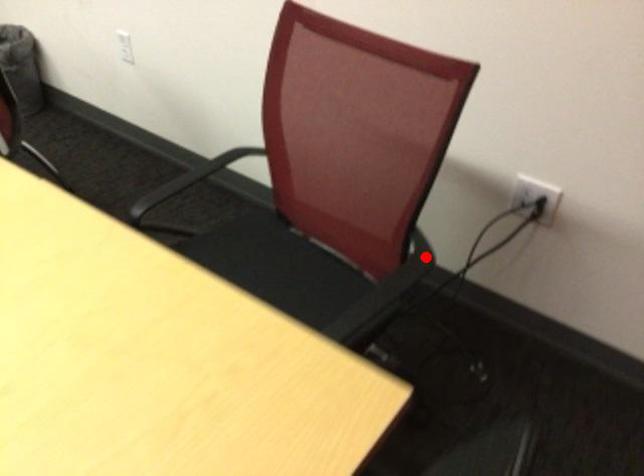
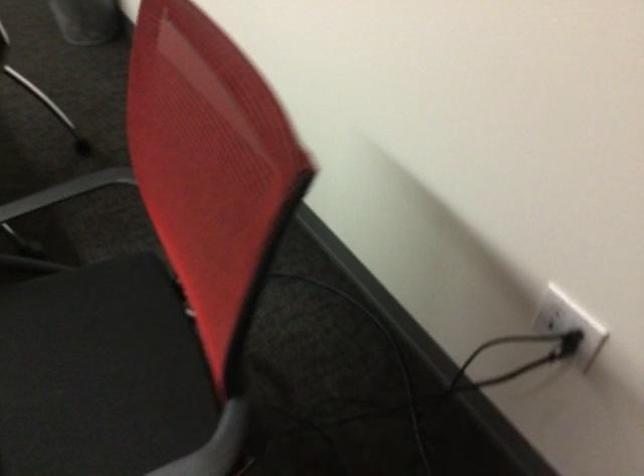
Find the pixel in the second image that matches the highlighted location in the first image.

(221, 443)